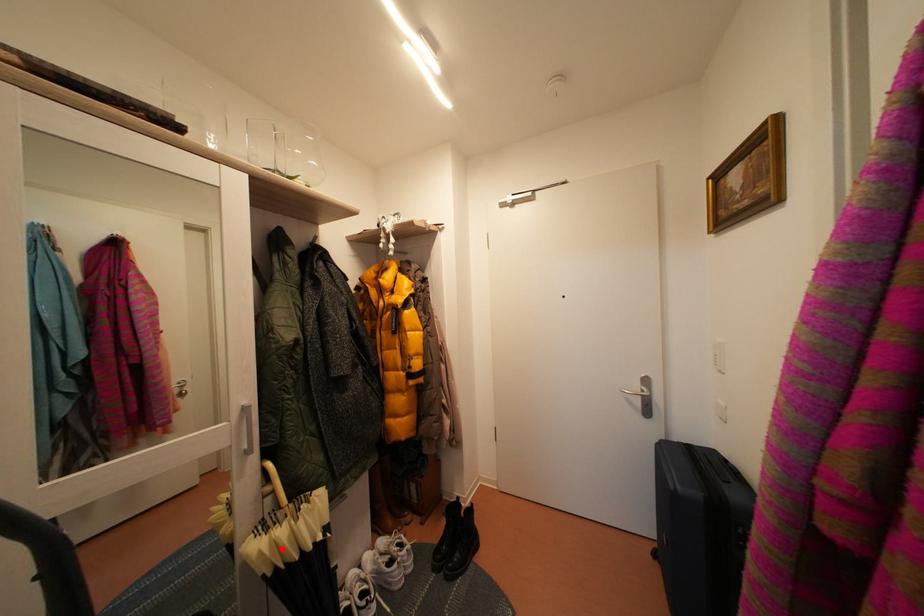
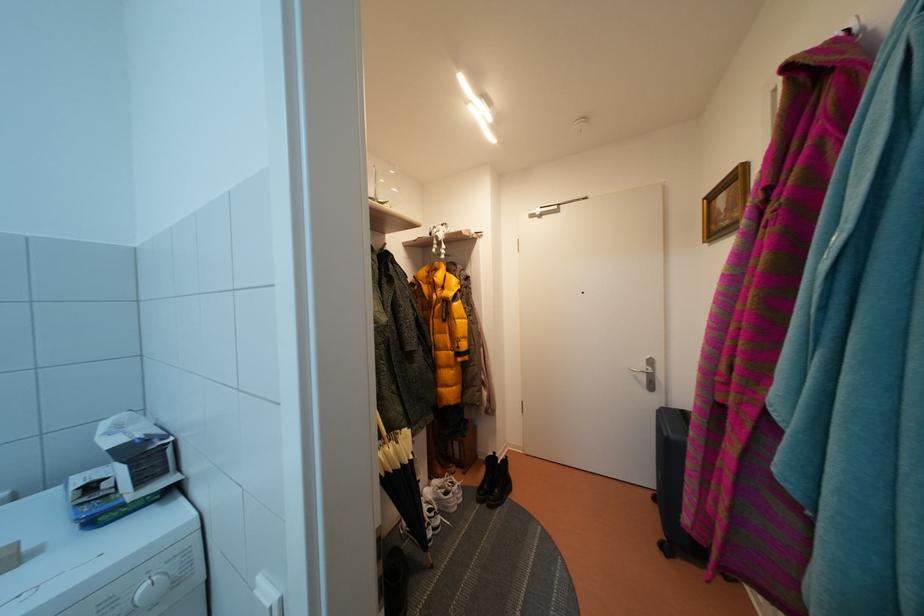
Where in the second image is the point corresponding to the highlighted location from the first image?

(393, 461)